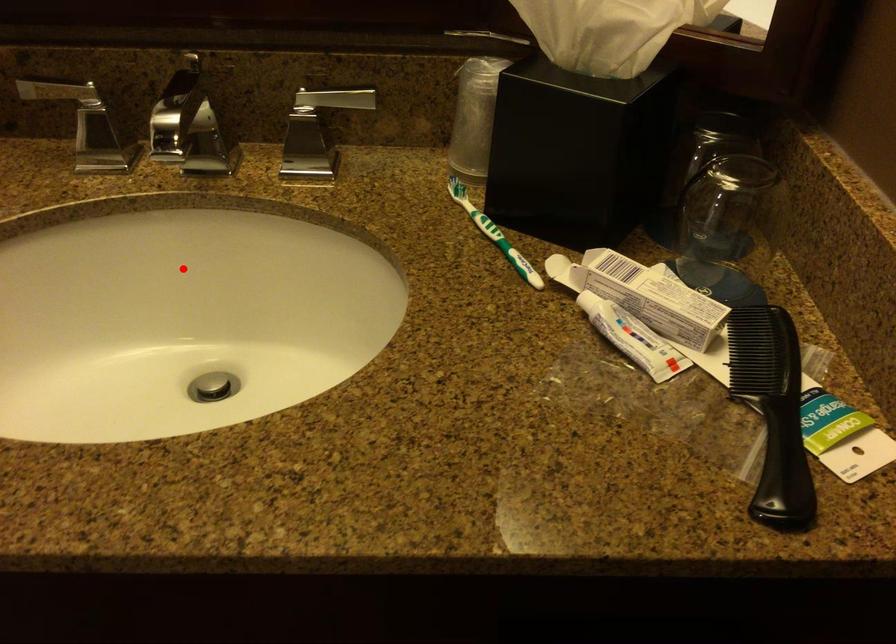
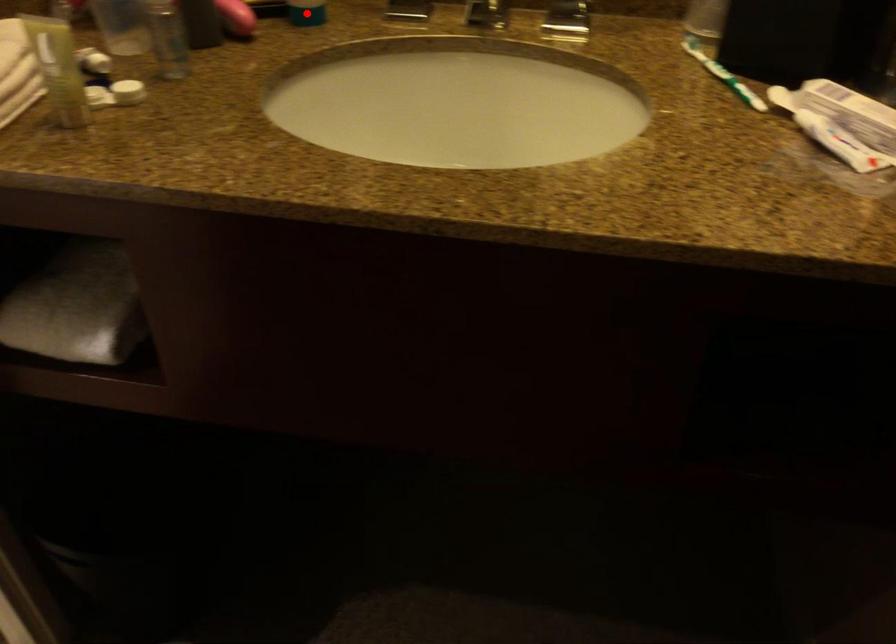
I am providing you with two images of the same scene from different viewpoints. A red point is marked on the first image and another point is marked on the second image. Is the red point in image1 aligned with the point shown in image2?

No